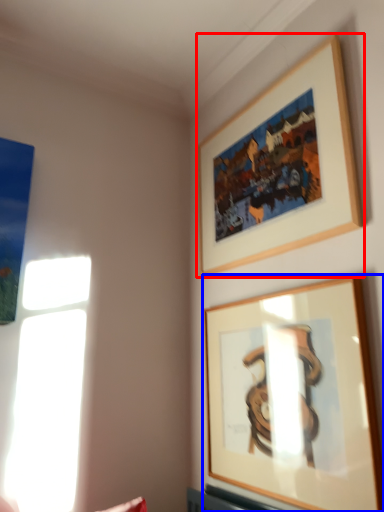
Question: Which object is further to the camera taking this photo, picture frame (highlighted by a red box) or picture frame (highlighted by a blue box)?

Choices:
 (A) picture frame
 (B) picture frame

Answer: (A)